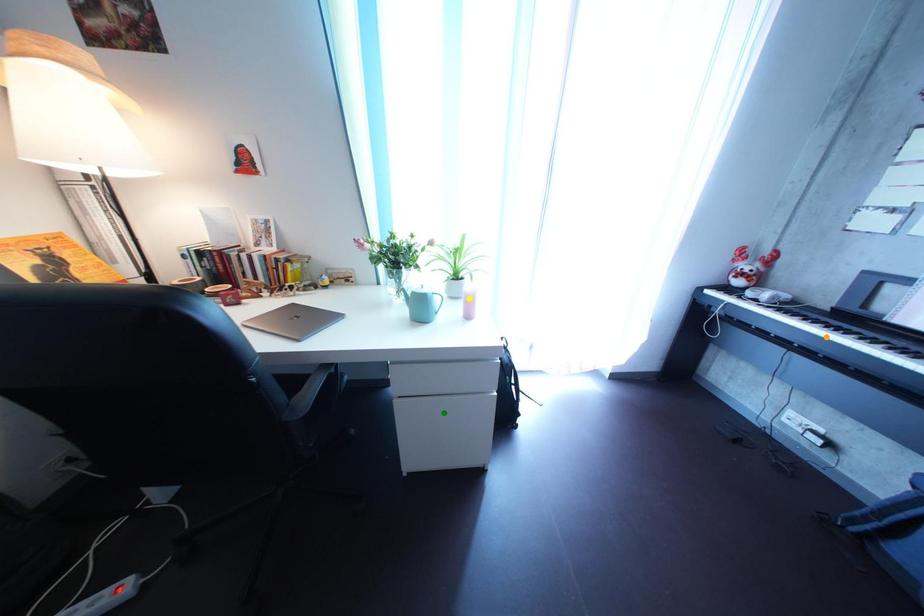
Order these from nearest to farthest:
green point
yellow point
orange point

green point, orange point, yellow point